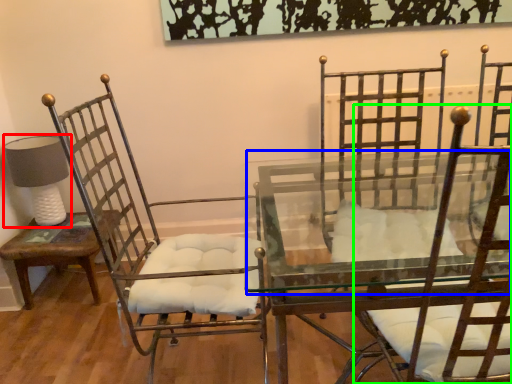
Question: Estimate the real-world distances between objects in this image. Which object is closer to table lamp (highlighted by a red box), round table (highlighted by a blue box) or chair (highlighted by a green box)?

Choices:
 (A) round table
 (B) chair

Answer: (A)